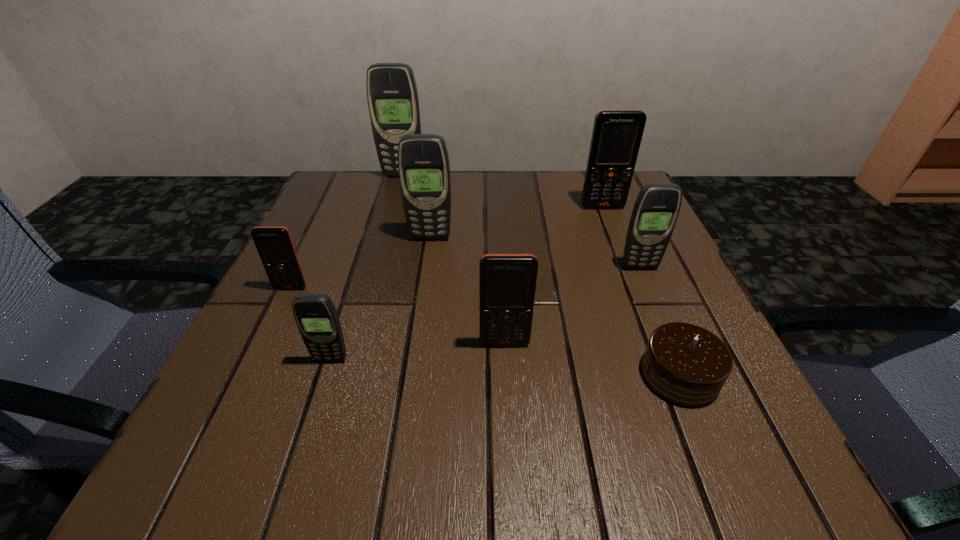
The image size is (960, 540). Find the location of `the leftmost cellular telephone`. the leftmost cellular telephone is located at coordinates (274, 245).

The width and height of the screenshot is (960, 540). I want to click on the smallest orange cellular telephone, so click(274, 245).

The width and height of the screenshot is (960, 540). What are the coordinates of `the smallest gray cellular telephone` in the screenshot? It's located at (316, 317).

Where is `the nearest gray cellular telephone`? Image resolution: width=960 pixels, height=540 pixels. the nearest gray cellular telephone is located at coordinates (316, 317).

Identify the location of chocolate cake. The image size is (960, 540). (685, 364).

Find the location of a particular element. This screenshot has height=540, width=960. the shortest object is located at coordinates (685, 364).

Image resolution: width=960 pixels, height=540 pixels. Find the location of `vacant space located on the screen of the tallest cellular telephone`. vacant space located on the screen of the tallest cellular telephone is located at coordinates (375, 275).

This screenshot has height=540, width=960. I want to click on free point located on the screen of the rightmost orange cellular telephone, so click(x=632, y=283).

Locate an element on the screen. free region located on the screen of the third nearest gray cellular telephone is located at coordinates (414, 355).

The width and height of the screenshot is (960, 540). What are the coordinates of `vacant position located on the screen of the fifth nearest object` in the screenshot? It's located at (673, 347).